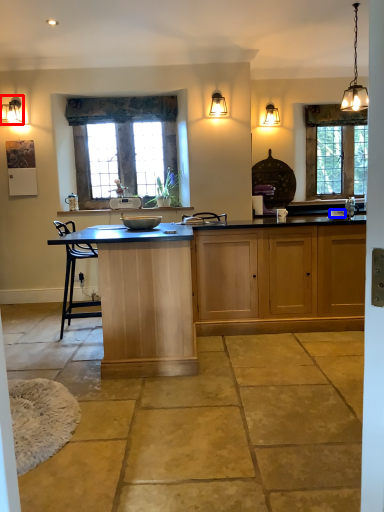
Question: Which object is further to the camera taking this photo, lamp (highlighted by a red box) or bowl (highlighted by a blue box)?

Choices:
 (A) lamp
 (B) bowl

Answer: (A)